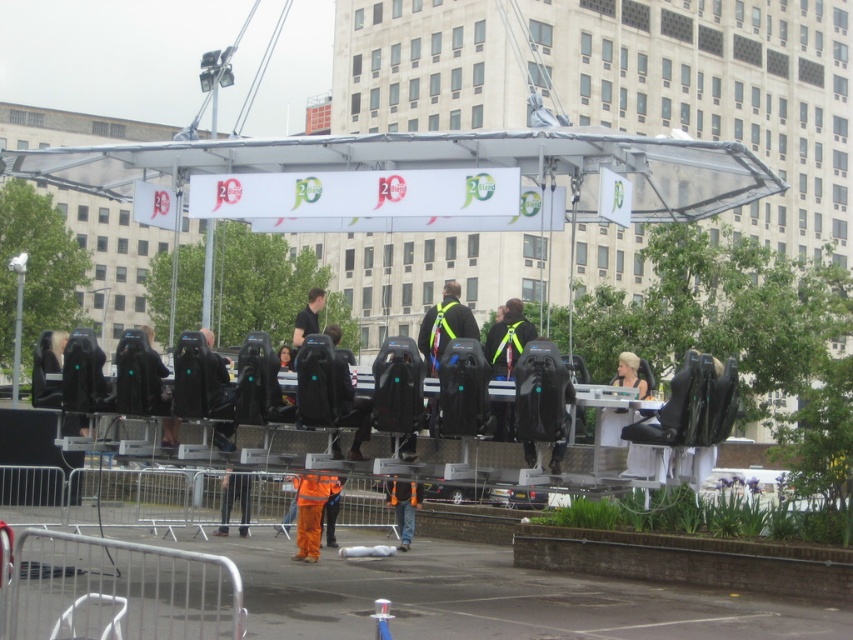
Is transparent plastic canopy at upper center thinner than black fabric jacket at center?

Incorrect, transparent plastic canopy at upper center's width is not less than black fabric jacket at center's.

Does point (300, 163) come closer to viewer compared to point (318, 307)?

No, it is not.

The height and width of the screenshot is (640, 853). Find the location of `transparent plastic canopy at upper center`. transparent plastic canopy at upper center is located at coordinates (428, 168).

Can you confirm if orange reflective safety vest at center is positioned below black fabric jacket at center?

Yes.

How far apart are orange reflective safety vest at center and black fabric jacket at center?

A distance of 12.63 feet exists between orange reflective safety vest at center and black fabric jacket at center.

Locate an element on the screen. The height and width of the screenshot is (640, 853). orange reflective safety vest at center is located at coordinates (404, 508).

Find the location of a particular element. The height and width of the screenshot is (640, 853). orange reflective safety vest at center is located at coordinates (404, 508).

Does transparent plastic canopy at upper center have a larger size compared to orange reflective overalls at center?

Correct, transparent plastic canopy at upper center is larger in size than orange reflective overalls at center.

Which is in front, point (416, 164) or point (300, 547)?

Point (416, 164) is in front.

You are a GUI agent. You are given a task and a screenshot of the screen. Output one action in this format:
    pyautogui.click(x=<x>, y=<y>)
    Task: Click on the transparent plastic canopy at upper center
    The height and width of the screenshot is (640, 853).
    Given the screenshot: What is the action you would take?
    tap(428, 168)